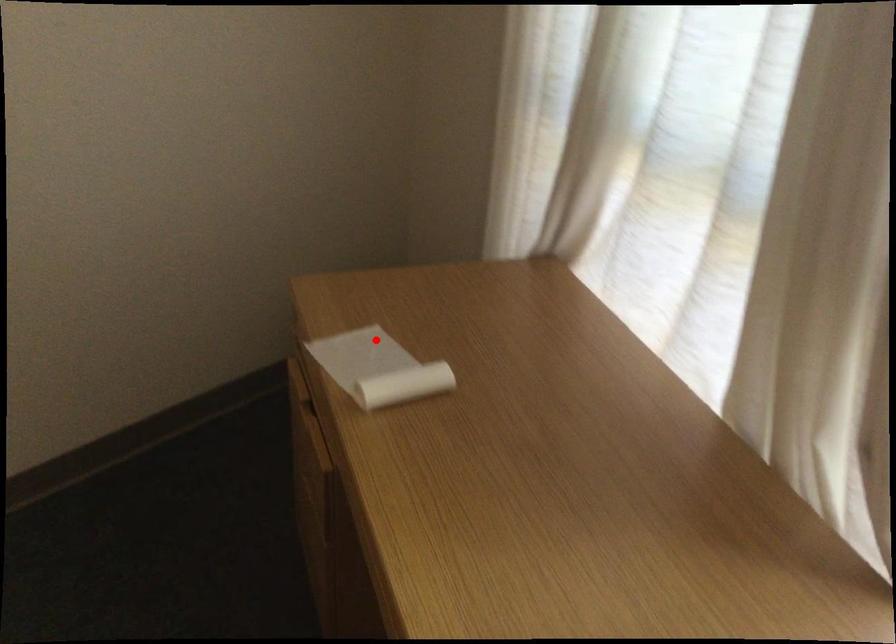
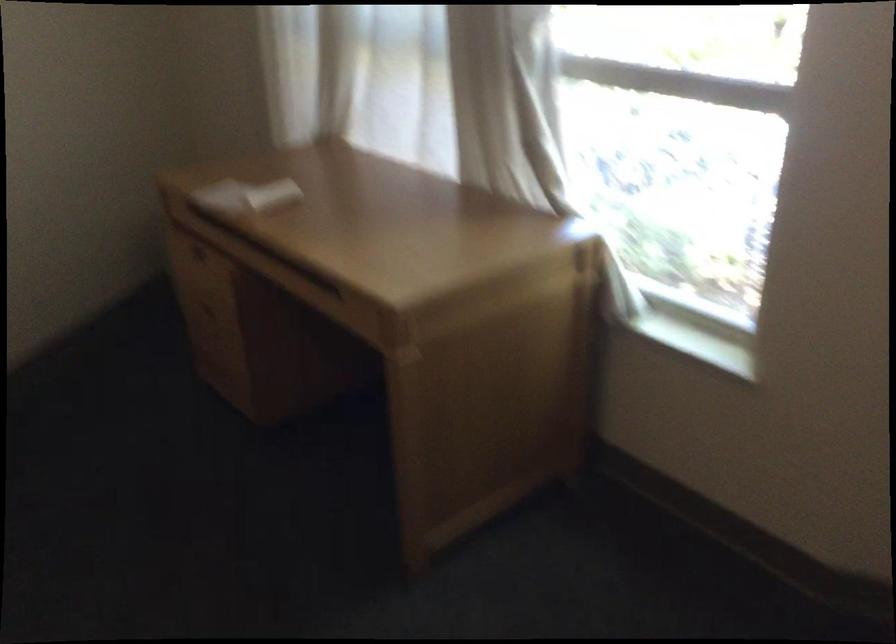
In the second image, find the point that corresponds to the highlighted location in the first image.

(234, 191)